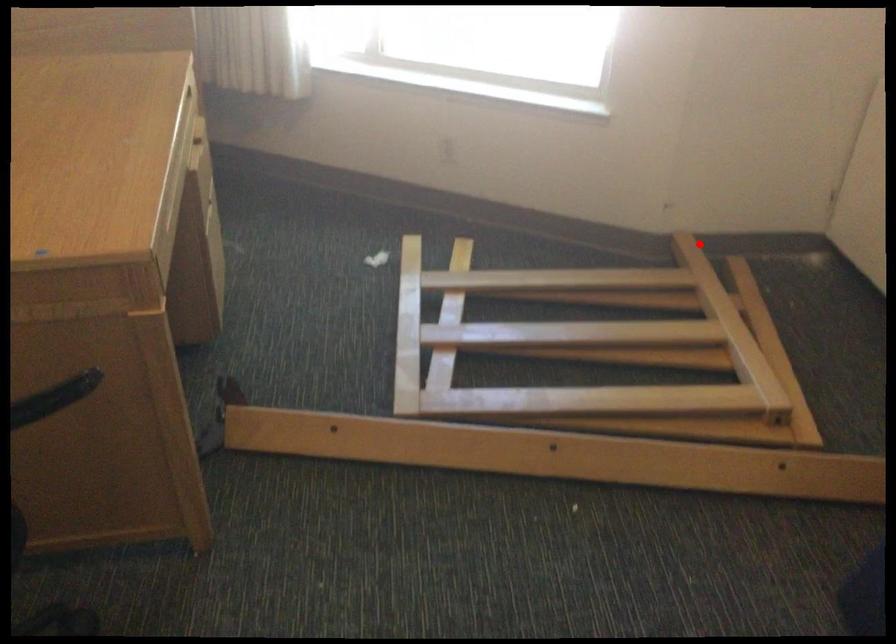
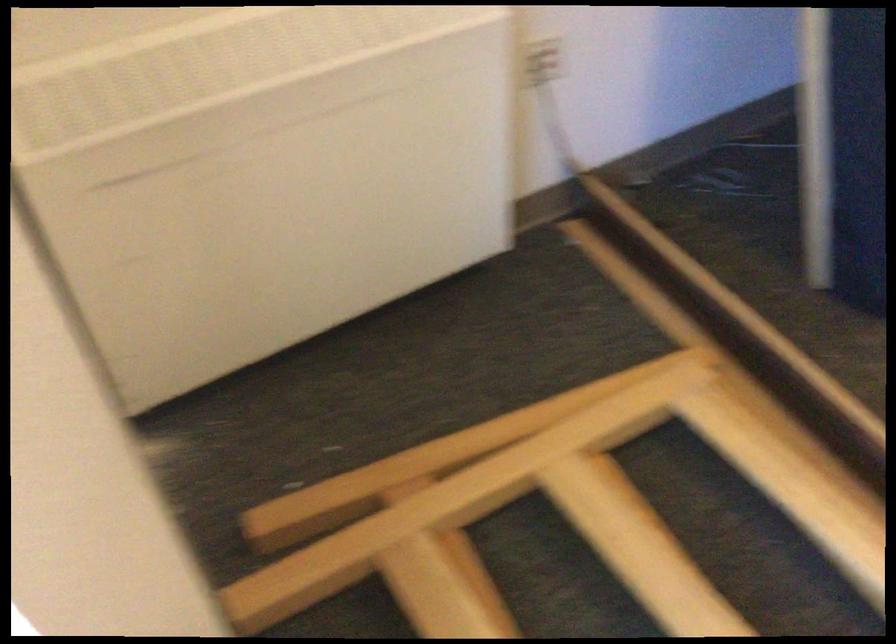
Question: A red point is marked in image1. In image2, is the corresponding 3D point closer to the camera or farther? Reply with the corresponding letter.

Choices:
 (A) The corresponding 3D point is closer.
 (B) The corresponding 3D point is farther.

Answer: (A)